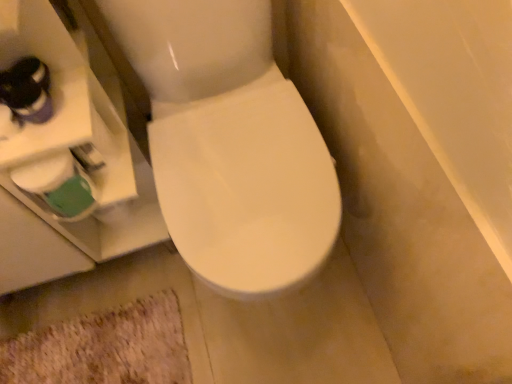
Find the location of `free point below beige shaggy bath mat at lower left (from a real-world perspective)`. free point below beige shaggy bath mat at lower left (from a real-world perspective) is located at coordinates pyautogui.click(x=106, y=345).